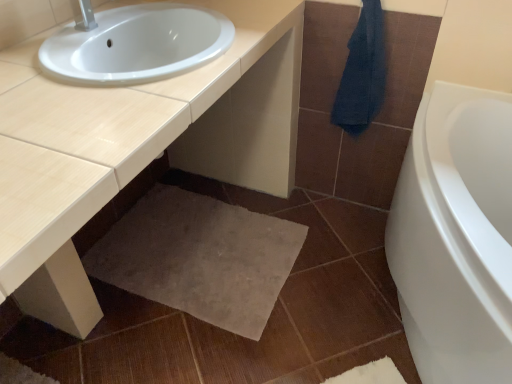
In order to face beige glossy countertop at center, should I rotate leftwards or rightwards?

Turn left by 15.607 degrees to look at beige glossy countertop at center.

The image size is (512, 384). Describe the element at coordinates (362, 73) in the screenshot. I see `dark blue towel at upper right` at that location.

This screenshot has height=384, width=512. In order to click on beige carpet at lower center in this screenshot , I will do `click(200, 257)`.

From a real-world perspective, which object stands above the other?

dark blue towel at upper right.

How different are the orientations of dark blue towel at upper right and beige glossy countertop at center in degrees?

The facing directions of dark blue towel at upper right and beige glossy countertop at center are 90.3 degrees apart.

Which object is further away from the camera, dark blue towel at upper right or beige glossy countertop at center?

dark blue towel at upper right.

From the image's perspective, is dark blue towel at upper right located above or below beige glossy countertop at center?

From the image's perspective, dark blue towel at upper right appears above beige glossy countertop at center.

Is beige carpet at lower center at the back of beige glossy countertop at center?

That's not correct — beige glossy countertop at center is not looking away from beige carpet at lower center.

From the image's perspective, does beige glossy countertop at center appear lower than beige carpet at lower center?

No, from the image's perspective, beige glossy countertop at center is not below beige carpet at lower center.

Locate an element on the screen. countertop above the beige carpet at lower center (from the image's perspective) is located at coordinates (231, 113).

From the picture: In terms of width, does beige glossy countertop at center look wider or thinner when compared to beige carpet at lower center?

In the image, beige glossy countertop at center appears to be more narrow than beige carpet at lower center.

How distant is dark blue towel at upper right from beige carpet at lower center?

dark blue towel at upper right and beige carpet at lower center are 28.43 inches apart.

Would you say dark blue towel at upper right contains beige carpet at lower center?

No, dark blue towel at upper right does not contain beige carpet at lower center.

Is dark blue towel at upper right taller than beige carpet at lower center?

Yes, dark blue towel at upper right is taller than beige carpet at lower center.

Can you confirm if dark blue towel at upper right is smaller than beige carpet at lower center?

Correct, dark blue towel at upper right occupies less space than beige carpet at lower center.

Considering the relative positions of beige carpet at lower center and dark blue towel at upper right in the image provided, is beige carpet at lower center to the left or to the right of dark blue towel at upper right?

In the image, beige carpet at lower center appears on the left side of dark blue towel at upper right.

In the scene shown: In terms of width, does beige carpet at lower center look wider or thinner when compared to dark blue towel at upper right?

Clearly, beige carpet at lower center has more width compared to dark blue towel at upper right.

Which is further, (186, 289) or (352, 67)?

The point (186, 289) is farther.

Would you consider beige carpet at lower center to be distant from dark blue towel at upper right?

No, beige carpet at lower center is not far away from dark blue towel at upper right.

Which is more to the left, beige carpet at lower center or beige glossy countertop at center?

From the viewer's perspective, beige glossy countertop at center appears more on the left side.

Considering their positions, is beige carpet at lower center located in front of or behind beige glossy countertop at center?

beige carpet at lower center is positioned farther from the viewer than beige glossy countertop at center.

Which of these two, beige carpet at lower center or beige glossy countertop at center, is wider?

With larger width is beige carpet at lower center.

Choose the correct answer: Is beige glossy countertop at center inside dark blue towel at upper right or outside it?

beige glossy countertop at center is spatially situated outside dark blue towel at upper right.

Are beige glossy countertop at center and dark blue towel at upper right located far from each other?

That's not correct — beige glossy countertop at center is a little close to dark blue towel at upper right.

Does beige glossy countertop at center have a greater width compared to dark blue towel at upper right?

Yes.

Considering their positions, is beige glossy countertop at center located in front of or behind dark blue towel at upper right?

Clearly, beige glossy countertop at center is in front of dark blue towel at upper right.

Locate an element on the screen. bath towel on the right of beige glossy countertop at center is located at coordinates (362, 73).

You are a GUI agent. You are given a task and a screenshot of the screen. Output one action in this format:
    pyautogui.click(x=<x>, y=<y>)
    Task: Click on the countertop that is above the beige carpet at lower center (from a real-world perspective)
    The image size is (512, 384).
    Given the screenshot: What is the action you would take?
    pyautogui.click(x=231, y=113)

Considering their positions, is beige carpet at lower center positioned closer to dark blue towel at upper right than beige glossy countertop at center?

The object closer to dark blue towel at upper right is beige glossy countertop at center.

From the image, which object appears to be nearer to beige carpet at lower center, beige glossy countertop at center or dark blue towel at upper right?

Based on the image, beige glossy countertop at center appears to be nearer to beige carpet at lower center.

Consider the image. Estimate the real-world distances between objects in this image. Which object is closer to beige carpet at lower center, dark blue towel at upper right or beige glossy countertop at center?

beige glossy countertop at center is closer to beige carpet at lower center.

Estimate the real-world distances between objects in this image. Which object is further from beige glossy countertop at center, dark blue towel at upper right or beige carpet at lower center?

beige carpet at lower center is further to beige glossy countertop at center.

Which object lies further to the anchor point beige glossy countertop at center, beige carpet at lower center or dark blue towel at upper right?

beige carpet at lower center.

Looking at the image, which one is located closer to dark blue towel at upper right, beige glossy countertop at center or beige carpet at lower center?

beige glossy countertop at center is positioned closer to the anchor dark blue towel at upper right.

You are a GUI agent. You are given a task and a screenshot of the screen. Output one action in this format:
    pyautogui.click(x=<x>, y=<y>)
    Task: Click on the bath towel between beige glossy countertop at center and beige carpet at lower center from front to back
    Image resolution: width=512 pixels, height=384 pixels.
    Given the screenshot: What is the action you would take?
    pyautogui.click(x=362, y=73)